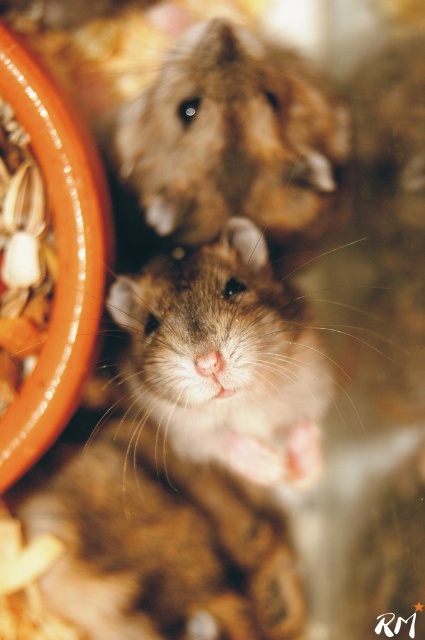
You are a photographer aiming to capture both fuzzy brown hamster at center and fuzzy brown hamster at upper center in focus. Based on their positions, which hamster should you adjust your camera focus to prioritize to include both in the frame?

The fuzzy brown hamster at center is located below the fuzzy brown hamster at upper center. To capture both in focus, adjust the camera focus to a point between them, ensuring both are within the depth of field.

You are holding a small toy mouse that is 2 feet long. You want to place it between yourself and the fuzzy brown hamster at center so that the hamster can see it clearly. Is the space between you and the hamster sufficient to fit the toy mouse without it being too close to either of you?

The distance between you and the fuzzy brown hamster at center is 3.94 feet. Since the toy mouse is 2 feet long, there is enough space to place it between you and the hamster without it being too close to either party.